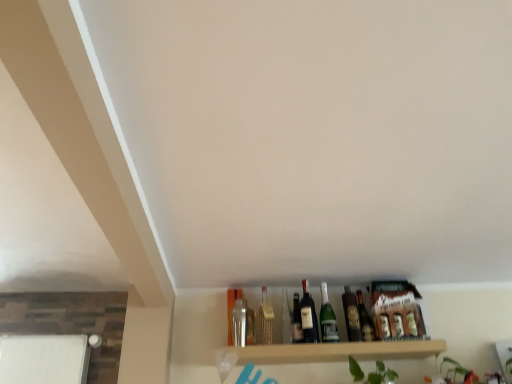
The height and width of the screenshot is (384, 512). What do you see at coordinates (351, 315) in the screenshot?
I see `matte glass beer bottle at center, which appears as the first beer bottle when viewed from the right` at bounding box center [351, 315].

The image size is (512, 384). What do you see at coordinates (322, 353) in the screenshot? I see `wooden shelf at lower center` at bounding box center [322, 353].

Describe the element at coordinates (365, 319) in the screenshot. I see `shiny dark glass bottle at center, the 4th bottle positioned from the left` at that location.

The width and height of the screenshot is (512, 384). Find the location of `clear glass wine bottle at center`. clear glass wine bottle at center is located at coordinates coord(265,319).

This screenshot has height=384, width=512. In order to click on metallic silver bottle at center, arranged as the 1th bottle when viewed from the left in this screenshot , I will do `click(242, 322)`.

The height and width of the screenshot is (384, 512). In order to click on matte glass beer bottle at center, which appears as the first beer bottle when viewed from the right in this screenshot , I will do `click(351, 315)`.

Is the position of matte glass beer bottle at center, placed as the 2th beer bottle when sorted from right to left, more distant than that of shiny dark glass bottle at center, the 4th bottle positioned from the left?

No.

Find the location of a particular element. The image size is (512, 384). the 2nd bottle to the right of the matte glass beer bottle at center, acting as the first beer bottle starting from the left, counting from the anchor's position is located at coordinates (365, 319).

Considering the positions of objects matte glass beer bottle at center, acting as the first beer bottle starting from the left, and shiny dark glass bottle at center, the 4th bottle positioned from the left, in the image provided, who is more to the right, matte glass beer bottle at center, acting as the first beer bottle starting from the left, or shiny dark glass bottle at center, the 4th bottle positioned from the left,?

Positioned to the right is shiny dark glass bottle at center, the 4th bottle positioned from the left.

Do you think matte glass beer bottle at center, placed as the 2th beer bottle when sorted from right to left, is within shiny dark glass bottle at center, the 4th bottle positioned from the left, or outside of it?

matte glass beer bottle at center, placed as the 2th beer bottle when sorted from right to left, is not inside shiny dark glass bottle at center, the 4th bottle positioned from the left, it's outside.

Is green glass bottle at center, the third bottle when ordered from left to right, with matte glass beer bottle at center, acting as the first beer bottle starting from the left?

No, green glass bottle at center, the third bottle when ordered from left to right, is not touching matte glass beer bottle at center, acting as the first beer bottle starting from the left.

How different are the orientations of green glass bottle at center, the third bottle when ordered from left to right, and matte glass beer bottle at center, placed as the 2th beer bottle when sorted from right to left, in degrees?

They differ by 0.000529 degrees in their facing directions.

Find the location of `beer bottle that appears above the green glass bottle at center, the third bottle when ordered from left to right (from a real-world perspective)`. beer bottle that appears above the green glass bottle at center, the third bottle when ordered from left to right (from a real-world perspective) is located at coordinates (308, 316).

Is green glass bottle at center, the third bottle when ordered from left to right, positioned beyond the bounds of matte glass beer bottle at center, placed as the 2th beer bottle when sorted from right to left?

green glass bottle at center, the third bottle when ordered from left to right, lies outside matte glass beer bottle at center, placed as the 2th beer bottle when sorted from right to left,'s area.

From a real-world perspective, which is physically below, metallic silver bottle at center, which appears as the fourth bottle when viewed from the right, or shiny dark glass bottle at center, the 4th bottle positioned from the left?

shiny dark glass bottle at center, the 4th bottle positioned from the left.

How different are the orientations of metallic silver bottle at center, which appears as the fourth bottle when viewed from the right, and shiny dark glass bottle at center, which is counted as the first bottle, starting from the right, in degrees?

There is a 0.000983-degree angle between the facing directions of metallic silver bottle at center, which appears as the fourth bottle when viewed from the right, and shiny dark glass bottle at center, which is counted as the first bottle, starting from the right.

Is metallic silver bottle at center, arranged as the 1th bottle when viewed from the left, positioned far away from shiny dark glass bottle at center, the 4th bottle positioned from the left?

No, metallic silver bottle at center, arranged as the 1th bottle when viewed from the left, is not far from shiny dark glass bottle at center, the 4th bottle positioned from the left.

Is shiny dark glass bottle at center, the 4th bottle positioned from the left, at the back of metallic silver bottle at center, which appears as the fourth bottle when viewed from the right?

No, metallic silver bottle at center, which appears as the fourth bottle when viewed from the right, is not facing away from shiny dark glass bottle at center, the 4th bottle positioned from the left.

Considering the relative positions of shiny dark glass bottle at center, the 4th bottle positioned from the left, and metallic silver bottle at center, arranged as the 1th bottle when viewed from the left, in the image provided, is shiny dark glass bottle at center, the 4th bottle positioned from the left, to the right of metallic silver bottle at center, arranged as the 1th bottle when viewed from the left, from the viewer's perspective?

Indeed, shiny dark glass bottle at center, the 4th bottle positioned from the left, is positioned on the right side of metallic silver bottle at center, arranged as the 1th bottle when viewed from the left.

This screenshot has width=512, height=384. There is a shiny dark glass bottle at center, the 4th bottle positioned from the left. What are the coordinates of `the 2nd bottle above it (from the image's perspective)` in the screenshot? It's located at (242, 322).

Does shiny dark glass bottle at center, which is counted as the first bottle, starting from the right, have a lesser width compared to metallic silver bottle at center, which appears as the fourth bottle when viewed from the right?

Yes.

From the image's perspective, who appears lower, shiny dark glass bottle at center, which is counted as the first bottle, starting from the right, or metallic silver bottle at center, arranged as the 1th bottle when viewed from the left?

From the image's view, shiny dark glass bottle at center, which is counted as the first bottle, starting from the right, is below.

Which of these two, clear glass wine bottle at center or matte glass bottle at center, the 3th bottle when ordered from right to left, stands taller?

clear glass wine bottle at center.

Is clear glass wine bottle at center positioned with its back to matte glass bottle at center, the 3th bottle when ordered from right to left?

No, clear glass wine bottle at center is not facing the opposite direction of matte glass bottle at center, the 3th bottle when ordered from right to left.

Is clear glass wine bottle at center further to camera compared to matte glass bottle at center, which ranks as the second bottle in left-to-right order?

No, clear glass wine bottle at center is in front of matte glass bottle at center, which ranks as the second bottle in left-to-right order.

Is clear glass wine bottle at center positioned far away from matte glass bottle at center, the 3th bottle when ordered from right to left?

They are positioned close to each other.

From the image's perspective, is matte glass bottle at center, the 3th bottle when ordered from right to left, over matte glass beer bottle at center, which is counted as the 2th beer bottle, starting from the left?

No, from the image's perspective, matte glass bottle at center, the 3th bottle when ordered from right to left, is not above matte glass beer bottle at center, which is counted as the 2th beer bottle, starting from the left.

Is point (298, 331) closer or farther from the camera than point (347, 293)?

Point (298, 331) is positioned closer to the camera compared to point (347, 293).

Considering the relative sizes of matte glass bottle at center, which ranks as the second bottle in left-to-right order, and matte glass beer bottle at center, which is counted as the 2th beer bottle, starting from the left, in the image provided, is matte glass bottle at center, which ranks as the second bottle in left-to-right order, smaller than matte glass beer bottle at center, which is counted as the 2th beer bottle, starting from the left,?

Indeed, matte glass bottle at center, which ranks as the second bottle in left-to-right order, has a smaller size compared to matte glass beer bottle at center, which is counted as the 2th beer bottle, starting from the left.

Can you confirm if metallic silver bottle at center, which appears as the fourth bottle when viewed from the right, is positioned to the right of wooden shelf at lower center?

In fact, metallic silver bottle at center, which appears as the fourth bottle when viewed from the right, is to the left of wooden shelf at lower center.

From the image's perspective, which one is positioned higher, metallic silver bottle at center, arranged as the 1th bottle when viewed from the left, or wooden shelf at lower center?

metallic silver bottle at center, arranged as the 1th bottle when viewed from the left, is shown above in the image.

Could you tell me if metallic silver bottle at center, which appears as the fourth bottle when viewed from the right, is turned towards wooden shelf at lower center?

No, metallic silver bottle at center, which appears as the fourth bottle when viewed from the right, is not oriented towards wooden shelf at lower center.

Where is `the 3rd bottle above the wooden shelf at lower center (from the image's perspective)`? the 3rd bottle above the wooden shelf at lower center (from the image's perspective) is located at coordinates point(242,322).

This screenshot has width=512, height=384. Identify the location of the 4th bottle positioned below the matte glass beer bottle at center, acting as the first beer bottle starting from the left (from a real-world perspective). (365, 319).

From the image's perspective, which bottle is the 1st one below the matte glass beer bottle at center, acting as the first beer bottle starting from the left? Please provide its 2D coordinates.

[(327, 318)]

Looking at the image, which one is located further to shiny dark glass bottle at center, which is counted as the first bottle, starting from the right, clear glass wine bottle at center or matte glass bottle at center, which ranks as the second bottle in left-to-right order?

clear glass wine bottle at center.

Considering their positions, is matte glass beer bottle at center, which appears as the first beer bottle when viewed from the right, positioned closer to wooden shelf at lower center than clear glass wine bottle at center?

matte glass beer bottle at center, which appears as the first beer bottle when viewed from the right, is closer to wooden shelf at lower center.

Based on their spatial positions, is wooden shelf at lower center or clear glass wine bottle at center further from metallic silver bottle at center, which appears as the fourth bottle when viewed from the right?

wooden shelf at lower center.

When comparing their distances from shiny dark glass bottle at center, the 4th bottle positioned from the left, does metallic silver bottle at center, arranged as the 1th bottle when viewed from the left, or clear glass wine bottle at center seem closer?

clear glass wine bottle at center lies closer to shiny dark glass bottle at center, the 4th bottle positioned from the left, than the other object.

Which object lies further to the anchor point matte glass beer bottle at center, which appears as the first beer bottle when viewed from the right, clear glass wine bottle at center or green glass bottle at center, which ranks as the second bottle in right-to-left order?

Based on the image, clear glass wine bottle at center appears to be further to matte glass beer bottle at center, which appears as the first beer bottle when viewed from the right.

From the image, which object appears to be farther from wooden shelf at lower center, metallic silver bottle at center, which appears as the fourth bottle when viewed from the right, or matte glass beer bottle at center, which appears as the first beer bottle when viewed from the right?

The object further to wooden shelf at lower center is metallic silver bottle at center, which appears as the fourth bottle when viewed from the right.

Looking at this image, estimate the real-world distances between objects in this image. Which object is further from shiny dark glass bottle at center, the 4th bottle positioned from the left, green glass bottle at center, the third bottle when ordered from left to right, or metallic silver bottle at center, arranged as the 1th bottle when viewed from the left?

metallic silver bottle at center, arranged as the 1th bottle when viewed from the left.

From the image, which object appears to be nearer to green glass bottle at center, the third bottle when ordered from left to right, matte glass beer bottle at center, which is counted as the 2th beer bottle, starting from the left, or metallic silver bottle at center, which appears as the fourth bottle when viewed from the right?

matte glass beer bottle at center, which is counted as the 2th beer bottle, starting from the left, lies closer to green glass bottle at center, the third bottle when ordered from left to right, than the other object.

This screenshot has height=384, width=512. Identify the location of bottle between clear glass wine bottle at center and green glass bottle at center, the third bottle when ordered from left to right, from left to right. (296, 321).

Where is `bottle between metallic silver bottle at center, which appears as the fourth bottle when viewed from the right, and matte glass beer bottle at center, placed as the 2th beer bottle when sorted from right to left, in the horizontal direction`? bottle between metallic silver bottle at center, which appears as the fourth bottle when viewed from the right, and matte glass beer bottle at center, placed as the 2th beer bottle when sorted from right to left, in the horizontal direction is located at coordinates (296, 321).

Find the location of a particular element. The width and height of the screenshot is (512, 384). beer bottle between matte glass beer bottle at center, placed as the 2th beer bottle when sorted from right to left, and shiny dark glass bottle at center, the 4th bottle positioned from the left, from left to right is located at coordinates [351, 315].

You are a GUI agent. You are given a task and a screenshot of the screen. Output one action in this format:
    pyautogui.click(x=<x>, y=<y>)
    Task: Click on the wine bottle between metallic silver bottle at center, arranged as the 1th bottle when viewed from the left, and shiny dark glass bottle at center, the 4th bottle positioned from the left
    
    Given the screenshot: What is the action you would take?
    pyautogui.click(x=265, y=319)